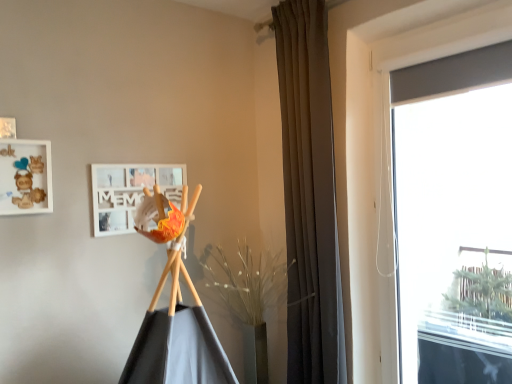
Question: Looking at the image, does brown fabric curtain at center seem bigger or smaller compared to transparent glass window at right?

Choices:
 (A) big
 (B) small

Answer: (A)

Question: In the image, is brown fabric curtain at center positioned in front of or behind transparent glass window at right?

Choices:
 (A) behind
 (B) front

Answer: (A)

Question: Considering the real-world distances, which object is farthest from the brown fabric curtain at center?

Choices:
 (A) wooden frame at upper left, marked as the 2th picture frame in a right-to-left arrangement
 (B) transparent glass window at right
 (C) white matte picture frame at upper center, which ranks as the second picture frame in front-to-back order

Answer: (A)

Question: Which of these objects is positioned closest to the transparent glass window at right?

Choices:
 (A) white matte picture frame at upper center, positioned as the first picture frame in back-to-front order
 (B) wooden frame at upper left, marked as the 2th picture frame in a right-to-left arrangement
 (C) brown fabric curtain at center

Answer: (C)